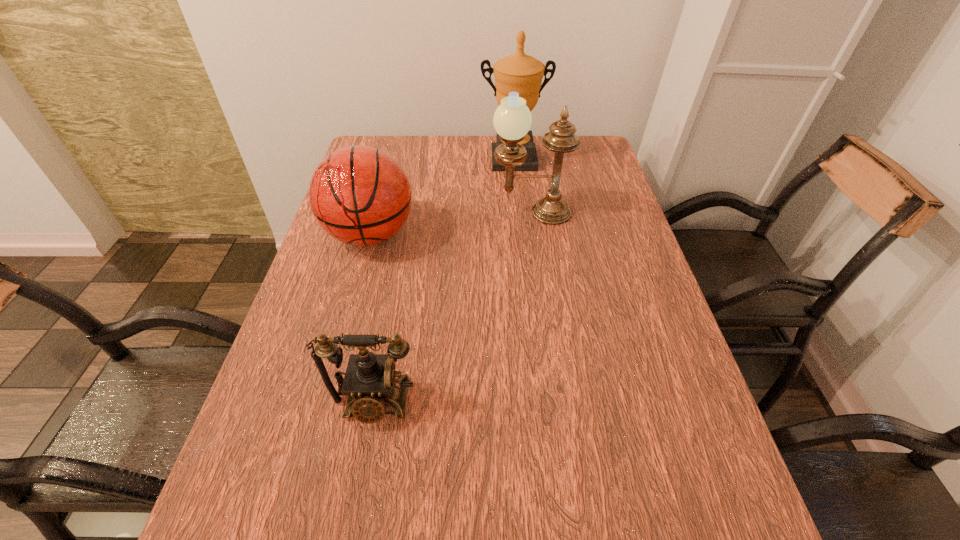
This screenshot has width=960, height=540. I want to click on award, so click(521, 73).

Image resolution: width=960 pixels, height=540 pixels. I want to click on oil lamp, so click(512, 120).

The height and width of the screenshot is (540, 960). Find the location of `basketball`. basketball is located at coordinates (361, 196).

Where is `the nearest object`? The height and width of the screenshot is (540, 960). the nearest object is located at coordinates (370, 384).

Find the location of a particular element. The image size is (960, 540). the shortest object is located at coordinates (370, 384).

Locate an element on the screen. vacant region located 0.110m at the front of the farthest object with handles is located at coordinates (516, 191).

You are a GUI agent. You are given a task and a screenshot of the screen. Output one action in this format:
    pyautogui.click(x=<x>, y=<y>)
    Task: Click on the vacant point located 0.060m on the front of the oil lamp
    The width and height of the screenshot is (960, 540).
    Given the screenshot: What is the action you would take?
    pyautogui.click(x=534, y=239)

Locate an element on the screen. free location located 0.370m on the side with spill of the second shortest object is located at coordinates (324, 401).

At what (x,y) coordinates should I click in order to perform the action: click on free point located on the rotary dial of the nearest object. Please return your answer as a coordinate pair (x, y). Looking at the image, I should click on point(360,476).

In order to click on object present at the far edge in this screenshot , I will do `click(521, 73)`.